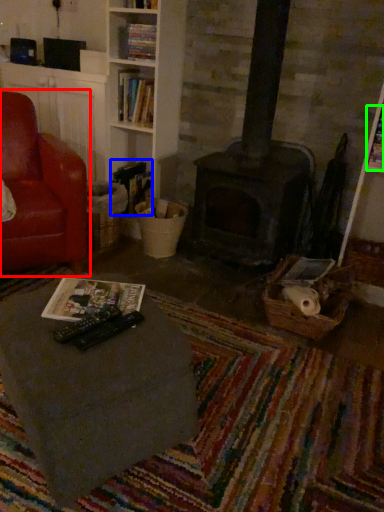
Question: Which object is the closest to the chair (highlighted by a red box)? Choose among these: book (highlighted by a blue box) or magazine (highlighted by a green box).

Choices:
 (A) book
 (B) magazine

Answer: (A)